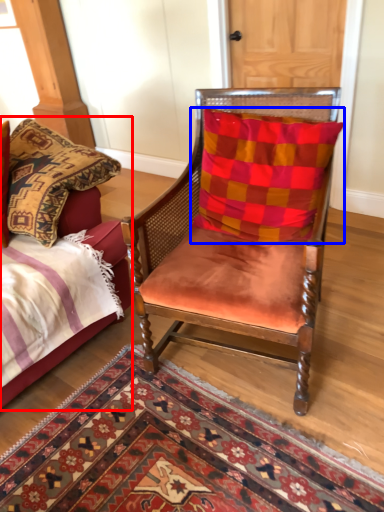
Question: Which object appears farthest to the camera in this image, bed (highlighted by a red box) or pillow (highlighted by a blue box)?

Choices:
 (A) bed
 (B) pillow

Answer: (B)